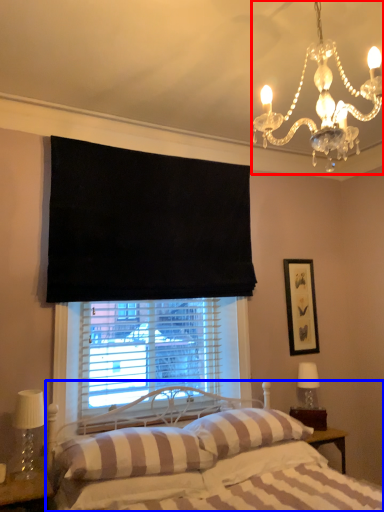
Question: Which of the following is the closest to the observer, light fixture (highlighted by a red box) or bed (highlighted by a blue box)?

Choices:
 (A) light fixture
 (B) bed

Answer: (B)